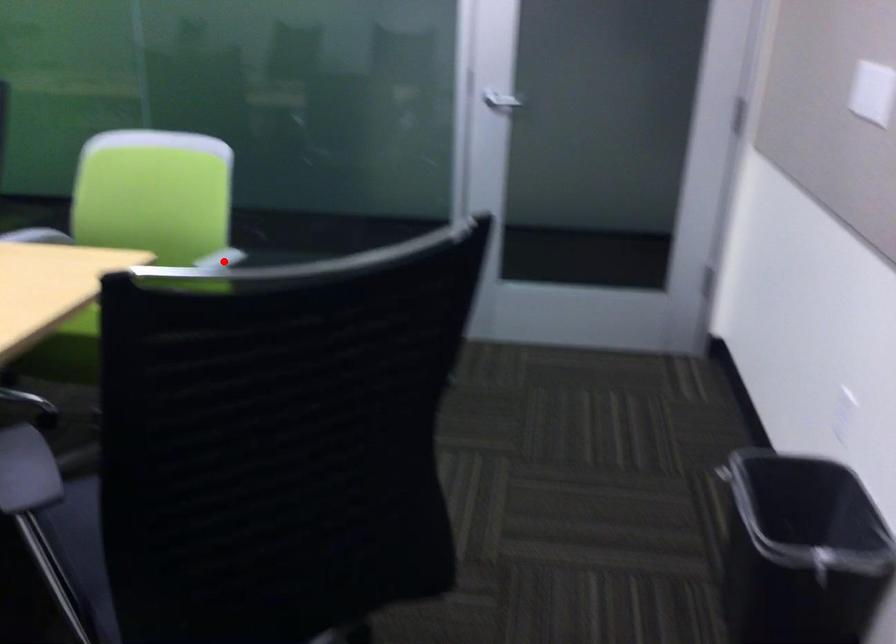
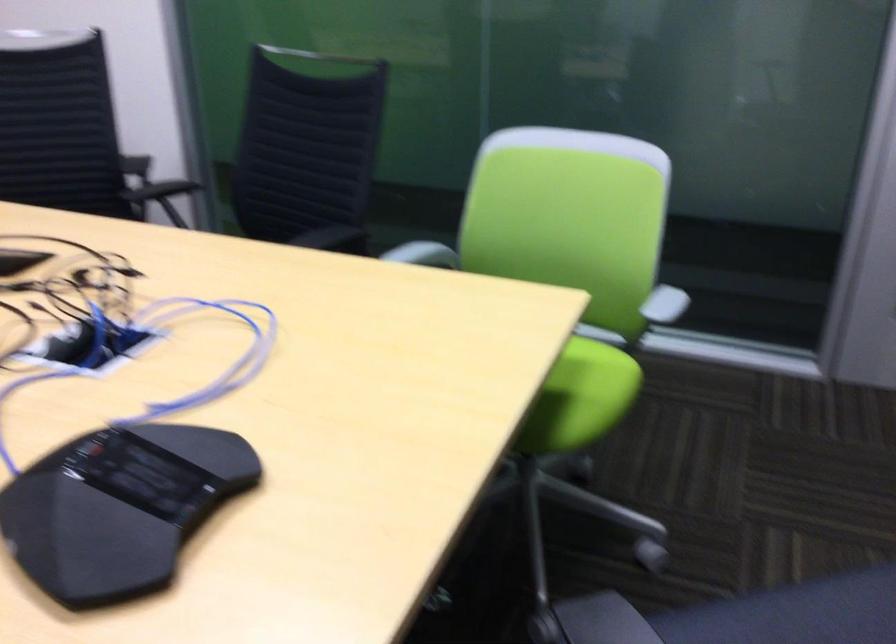
Question: I am providing you with two images of the same scene from different viewpoints. Given a red point in image1, look at the same physical point in image2. Is it:

Choices:
 (A) Closer to the viewpoint
 (B) Farther from the viewpoint

Answer: (A)